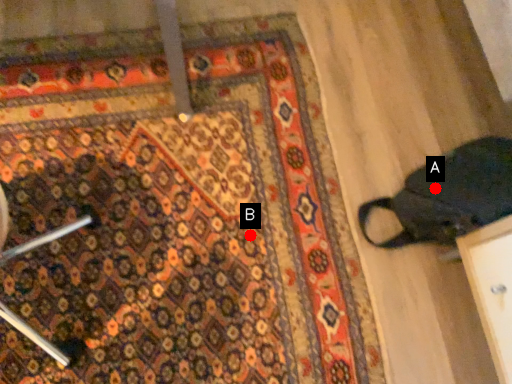
Question: Two points are circled on the image, labeled by A and B beside each circle. Which point is farther to the camera?

Choices:
 (A) A is further
 (B) B is further

Answer: (B)